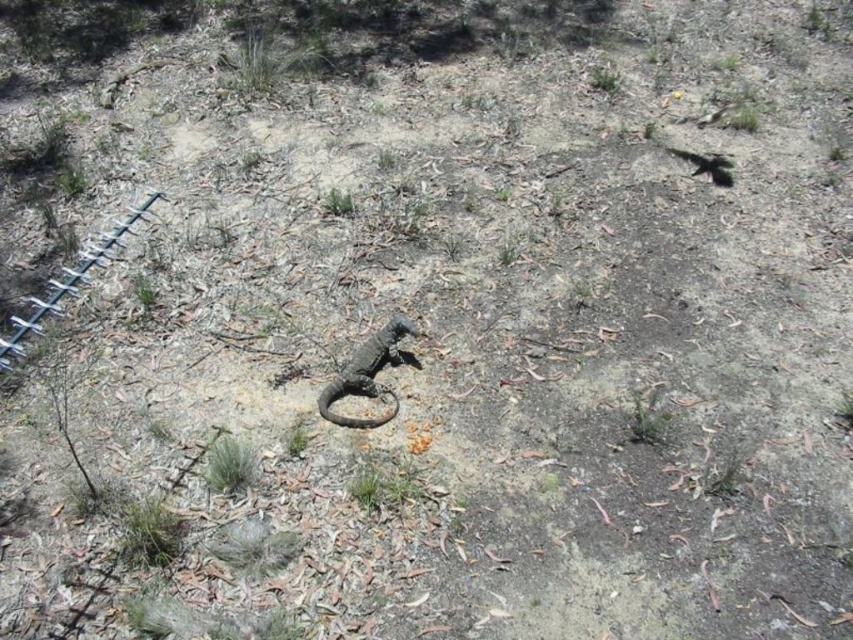
Question: Is green grass at lower left to the left of green leafy grass at center from the viewer's perspective?

Choices:
 (A) yes
 (B) no

Answer: (A)

Question: Which point is farther to the camera?

Choices:
 (A) (229, 474)
 (B) (335, 208)
 (C) (381, 330)

Answer: (B)

Question: Which point appears farthest from the camera in this image?

Choices:
 (A) (384, 346)
 (B) (248, 461)

Answer: (A)

Question: Is green grass at lower left to the right of green leafy grass at center from the viewer's perspective?

Choices:
 (A) yes
 (B) no

Answer: (B)

Question: Observing the image, what is the correct spatial positioning of green grass at lower left in reference to green leafy grass at center?

Choices:
 (A) below
 (B) above

Answer: (A)

Question: Which of the following is the farthest from the observer?

Choices:
 (A) green grass at lower left
 (B) green grass at upper center

Answer: (B)